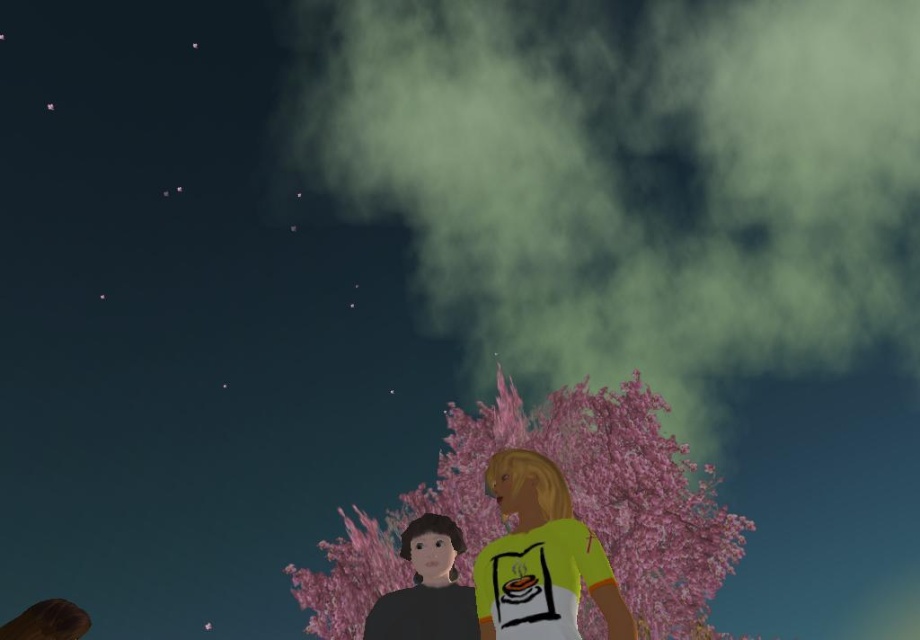
Can you confirm if pink matte tree at center is taller than yellow matte shirt at center?

Indeed, pink matte tree at center has a greater height compared to yellow matte shirt at center.

Who is more distant from viewer, (x=447, y=404) or (x=555, y=586)?

Positioned behind is point (x=447, y=404).

Locate an element on the screen. The width and height of the screenshot is (920, 640). pink matte tree at center is located at coordinates (573, 504).

Does pink matte tree at center appear under matte black shirt at lower left?

Yes.

Does pink matte tree at center have a larger size compared to matte black shirt at lower left?

Indeed, pink matte tree at center has a larger size compared to matte black shirt at lower left.

Between point (749, 531) and point (437, 538), which one is positioned behind?

Positioned behind is point (749, 531).

The height and width of the screenshot is (640, 920). I want to click on pink matte tree at center, so click(573, 504).

Does yellow matte shirt at center have a lesser height compared to matte black shirt at lower left?

Incorrect, yellow matte shirt at center's height does not fall short of matte black shirt at lower left's.

Does yellow matte shirt at center appear under matte black shirt at lower left?

Actually, yellow matte shirt at center is above matte black shirt at lower left.

This screenshot has width=920, height=640. Identify the location of yellow matte shirt at center. (539, 557).